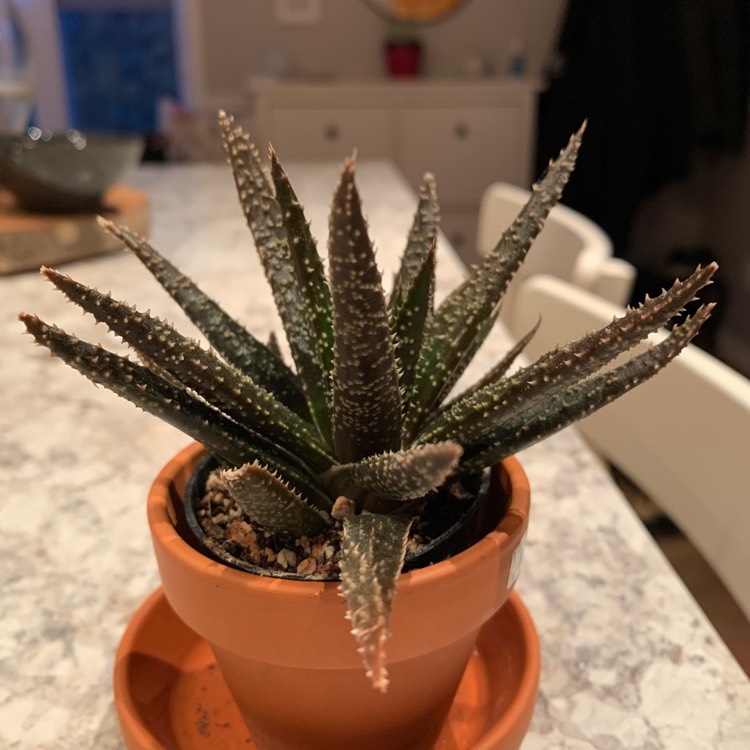
I want to click on counter, so click(x=585, y=531).